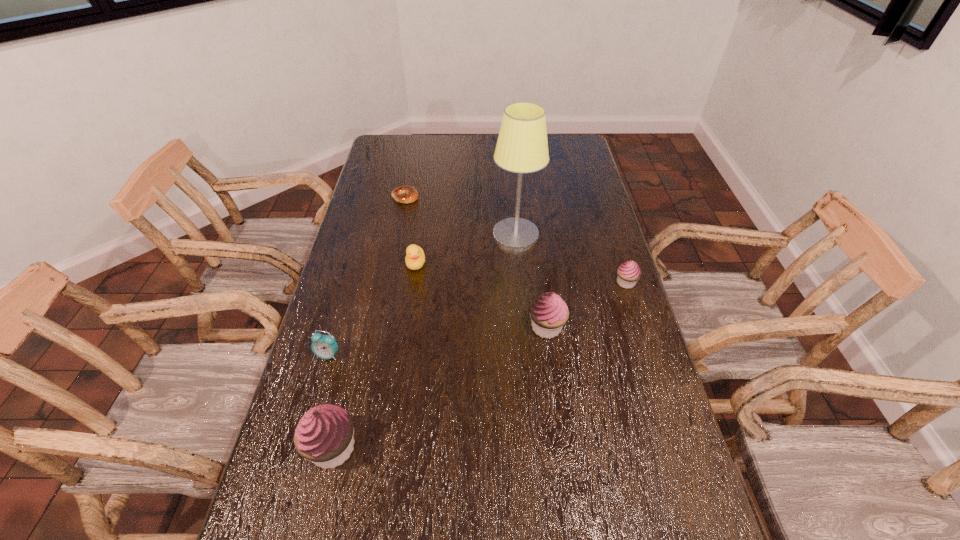
Find the location of `bagel present at the left edge`. bagel present at the left edge is located at coordinates (406, 194).

Locate an element on the screen. The height and width of the screenshot is (540, 960). alarm clock that is at the left edge is located at coordinates click(324, 346).

This screenshot has width=960, height=540. What are the coordinates of `object that is at the right edge` in the screenshot? It's located at (629, 272).

Locate an element on the screen. The image size is (960, 540). free space at the far edge is located at coordinates click(461, 134).

The width and height of the screenshot is (960, 540). Find the location of `free spot at the near edge of the desktop`. free spot at the near edge of the desktop is located at coordinates (568, 493).

This screenshot has height=540, width=960. Identify the location of free space at the left edge of the desktop. (336, 301).

You are a GUI agent. You are given a task and a screenshot of the screen. Output one action in this format:
    pyautogui.click(x=<x>, y=<y>)
    Task: Click on the vacant space at the right edge
    The width and height of the screenshot is (960, 540).
    Given the screenshot: What is the action you would take?
    pyautogui.click(x=622, y=350)

The image size is (960, 540). I want to click on vacant area at the far left corner of the desktop, so click(x=402, y=139).

Where is `free space at the far right corner of the desktop`? Image resolution: width=960 pixels, height=540 pixels. free space at the far right corner of the desktop is located at coordinates (551, 154).

Locate an element on the screen. This screenshot has width=960, height=540. vacant space at the near right corner is located at coordinates (645, 498).